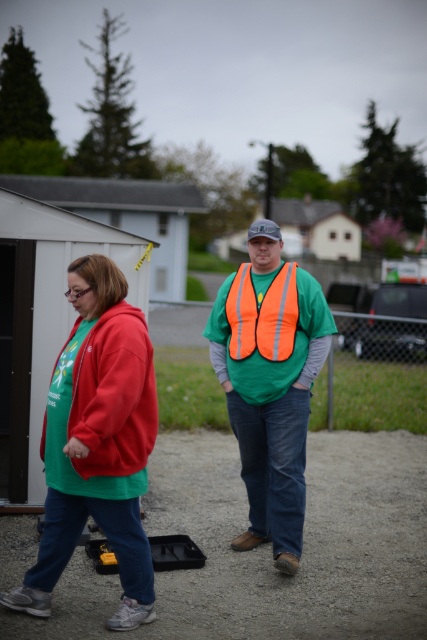
Question: Can you confirm if matte fleece jacket at left is positioned below reflective orange safety vest at center?

Choices:
 (A) yes
 (B) no

Answer: (A)

Question: Among these objects, which one is nearest to the camera?

Choices:
 (A) matte green hoodie at left
 (B) reflective orange vest at center
 (C) matte fleece jacket at left

Answer: (A)

Question: Is matte fleece jacket at left to the left of matte green jacket at center from the viewer's perspective?

Choices:
 (A) no
 (B) yes

Answer: (B)

Question: Among these objects, which one is farthest from the camera?

Choices:
 (A) white plastic hut at upper left
 (B) reflective orange safety vest at center

Answer: (A)

Question: Is matte green hoodie at left smaller than matte fleece jacket at left?

Choices:
 (A) no
 (B) yes

Answer: (A)

Question: Which object appears closest to the camera in this image?

Choices:
 (A) matte green hoodie at left
 (B) reflective orange safety vest at center
 (C) reflective orange vest at center

Answer: (A)